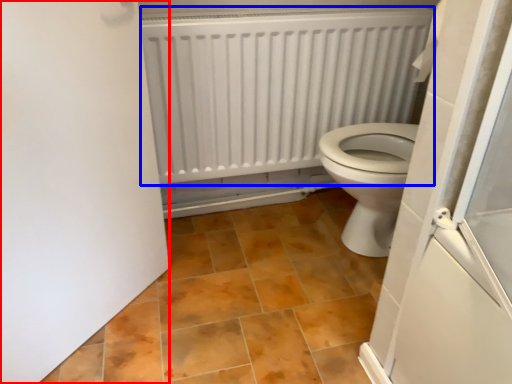
Question: Among these objects, which one is nearest to the camera, door (highlighted by a red box) or radiator (highlighted by a blue box)?

Choices:
 (A) door
 (B) radiator

Answer: (A)